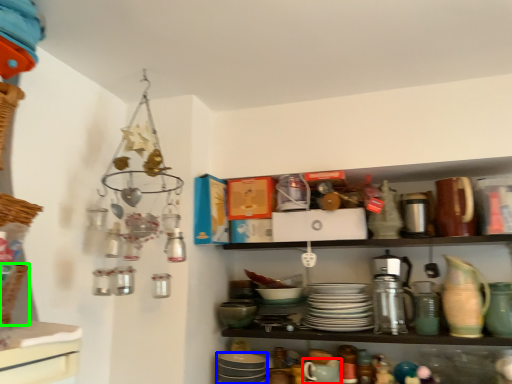
Question: Based on their relative distances, which object is nearer to tableware (highlighted by a red box)? Choose from tableware (highlighted by a blue box) and basket (highlighted by a green box).

Choices:
 (A) tableware
 (B) basket

Answer: (A)